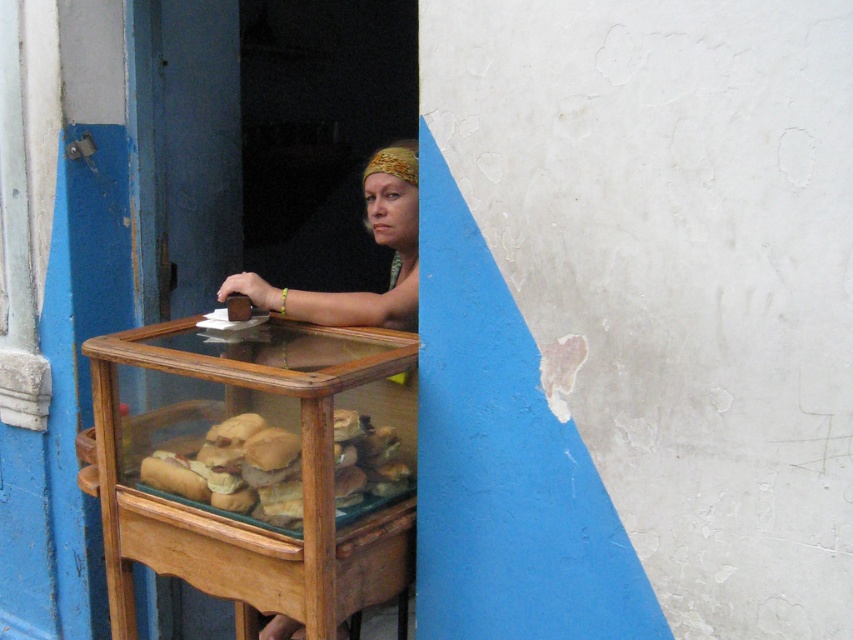
Question: Which of the following is the farthest from the observer?

Choices:
 (A) matte brown hair at center
 (B) golden brown bread at center

Answer: (A)

Question: Does golden brown bread at center have a smaller size compared to matte brown hair at center?

Choices:
 (A) yes
 (B) no

Answer: (A)

Question: Can you confirm if golden brown bread at center is wider than matte brown hair at center?

Choices:
 (A) no
 (B) yes

Answer: (B)

Question: Which of the following is the farthest from the observer?

Choices:
 (A) golden brown bread at center
 (B) matte brown hair at center

Answer: (B)

Question: Is golden brown bread at center thinner than matte brown hair at center?

Choices:
 (A) no
 (B) yes

Answer: (A)